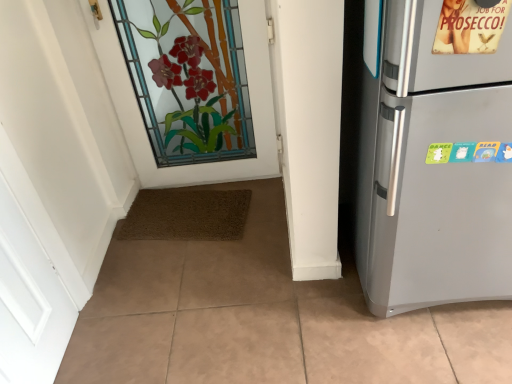
Question: From their relative heights in the image, would you say stained glass door at upper center is taller or shorter than satin silver refrigerator at right?

Choices:
 (A) short
 (B) tall

Answer: (A)

Question: Is point (259, 87) closer or farther from the camera than point (476, 233)?

Choices:
 (A) closer
 (B) farther

Answer: (B)

Question: In the image, is stained glass door at upper center positioned in front of or behind satin silver refrigerator at right?

Choices:
 (A) behind
 (B) front

Answer: (A)

Question: Visually, is satin silver refrigerator at right positioned to the left or to the right of stained glass door at upper center?

Choices:
 (A) right
 (B) left

Answer: (A)

Question: In terms of height, does satin silver refrigerator at right look taller or shorter compared to stained glass door at upper center?

Choices:
 (A) short
 (B) tall

Answer: (B)

Question: From the image's perspective, is satin silver refrigerator at right above or below stained glass door at upper center?

Choices:
 (A) above
 (B) below

Answer: (B)

Question: In the image, is satin silver refrigerator at right positioned in front of or behind stained glass door at upper center?

Choices:
 (A) front
 (B) behind

Answer: (A)